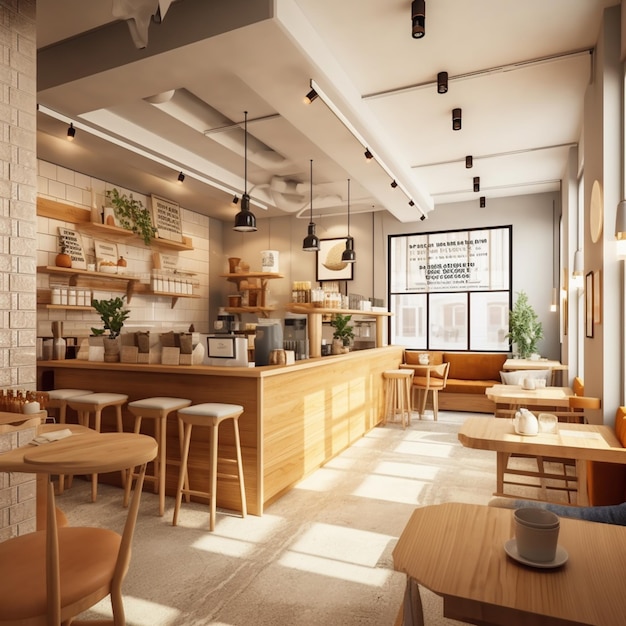
Locate an element on the screen. The width and height of the screenshot is (626, 626). barstool is located at coordinates (201, 414), (403, 377), (163, 404), (95, 404), (68, 393).